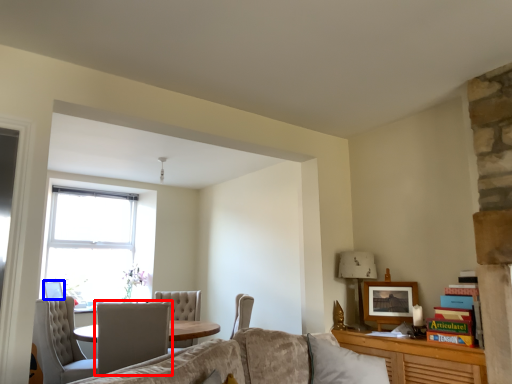
Question: Which object appears farthest to the camera in this image, chair (highlighted by a red box) or picture frame (highlighted by a blue box)?

Choices:
 (A) chair
 (B) picture frame

Answer: (B)